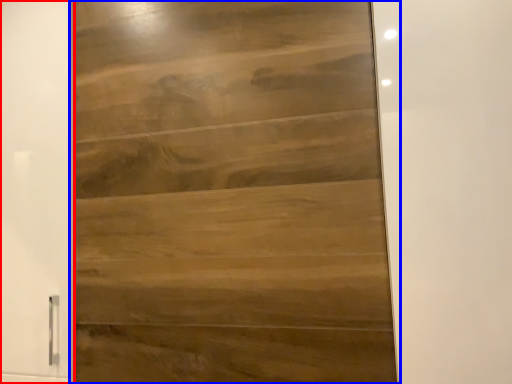
Question: Which of the following is the closest to the observer, barn door (highlighted by a red box) or door (highlighted by a blue box)?

Choices:
 (A) barn door
 (B) door

Answer: (B)